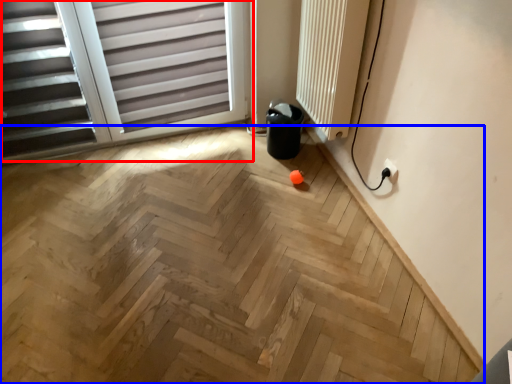
Question: Which object appears closest to the camera in this image, window (highlighted by a red box) or plywood (highlighted by a blue box)?

Choices:
 (A) window
 (B) plywood

Answer: (B)